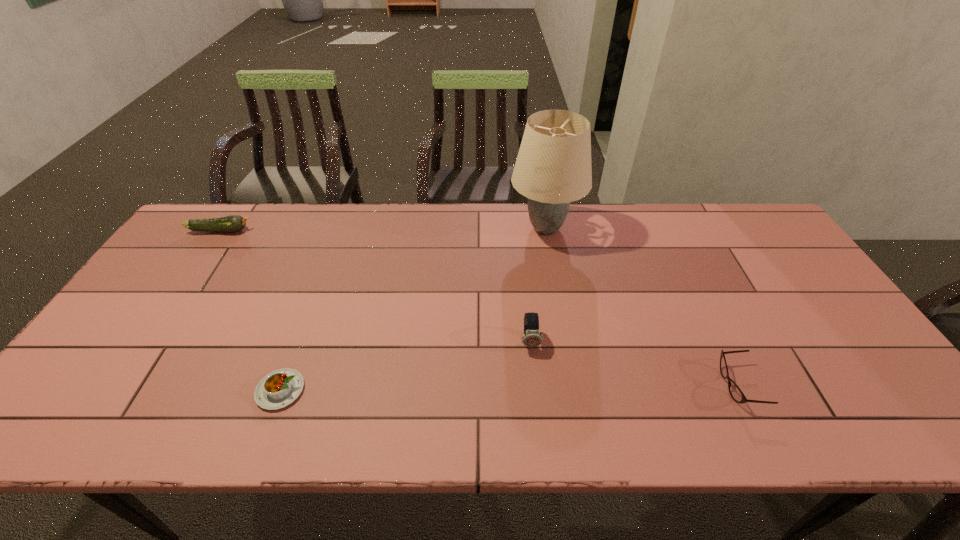
Image resolution: width=960 pixels, height=540 pixels. In the image, there is a desktop. Find the location of `vacant space at the far edge`. vacant space at the far edge is located at coordinates (416, 247).

This screenshot has width=960, height=540. What are the coordinates of `vacant area at the left edge of the desktop` in the screenshot? It's located at [x=189, y=311].

The width and height of the screenshot is (960, 540). Find the location of `free space at the right edge`. free space at the right edge is located at coordinates (794, 343).

This screenshot has height=540, width=960. In the image, there is a desktop. Identify the location of vacant space at the far left corner. (206, 245).

Identify the location of free space at the far right corner. Image resolution: width=960 pixels, height=540 pixels. (727, 215).

Find the location of a particular element. The height and width of the screenshot is (540, 960). vacant space in between the lampshade and the shortest object is located at coordinates (413, 309).

The image size is (960, 540). Identify the location of vacant region between the shortest object and the third farthest object. (405, 366).

Identify the location of empty space that is in between the shortest object and the leftmost object. (251, 310).

Locate an element on the screen. This screenshot has width=960, height=540. vacant area that lies between the zucchini and the lampshade is located at coordinates (383, 230).

You are a GUI agent. You are given a task and a screenshot of the screen. Output one action in this format:
    pyautogui.click(x=<x>, y=<y>)
    Task: Click on the free space between the fourth shortest object and the spectacles
    The width and height of the screenshot is (960, 540).
    Given the screenshot: What is the action you would take?
    pyautogui.click(x=635, y=363)